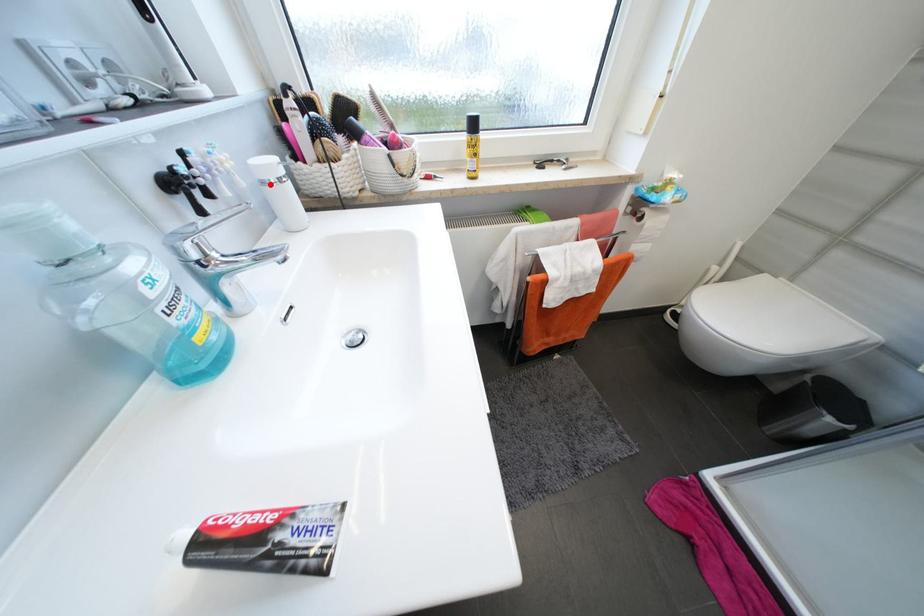
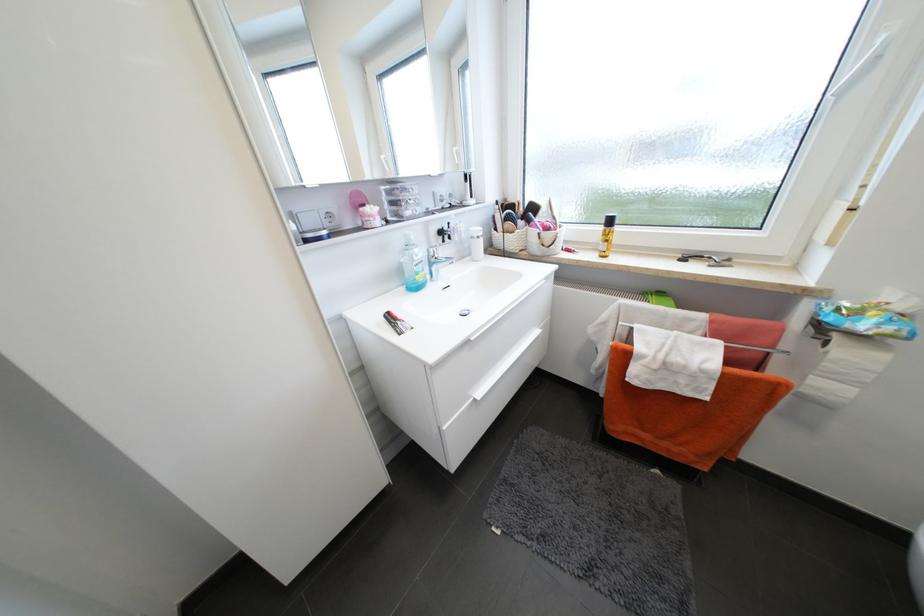
In the second image, find the point that corresponds to the highlighted location in the first image.

(478, 238)